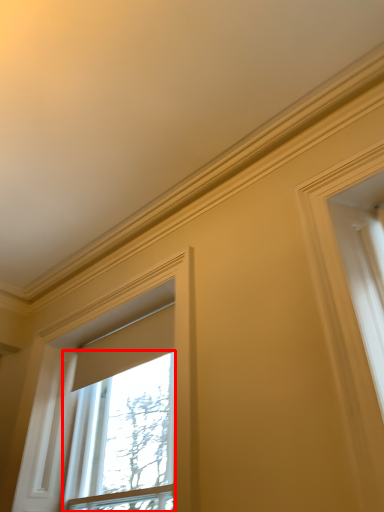
Question: From the image's perspective, where is window (annotated by the red box) located relative to window?

Choices:
 (A) below
 (B) above

Answer: (A)